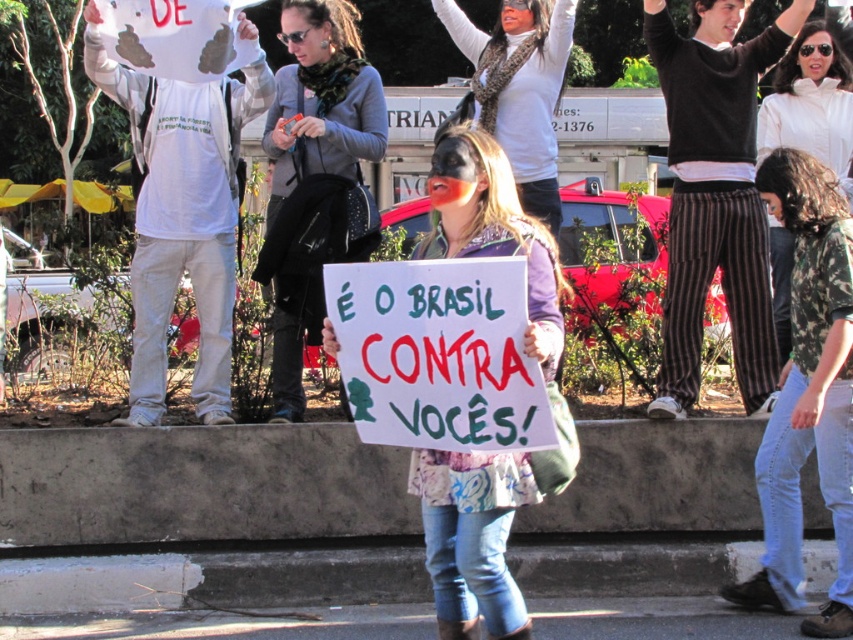
You are a photographer at the protest scene. You want to capture a photo where the white paper sign at center is clearly visible without being blocked by the matte black mask at center. Based on the scene description, is this possible?

The white paper sign at center is located below the matte black mask at center, so if you position yourself or adjust the angle to focus on the lower part of the central figure, the sign will be visible without obstruction from the mask.

You are a photographer trying to capture the protest scene. You notice the white paper sign at center and the matte black mask at center. Which object should you zoom in on to ensure both are visible in the frame without cropping?

The white paper sign at center occupies less space than the matte black mask at center, so you should zoom in on the matte black mask at center to ensure both fit in the frame without cropping.